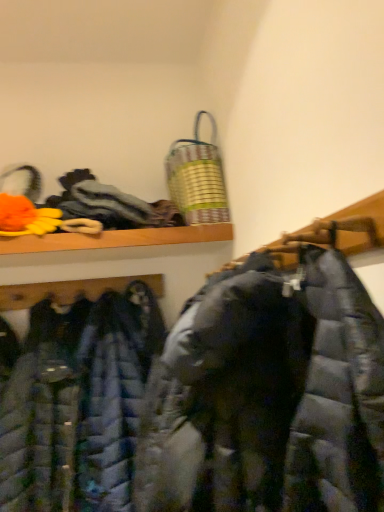
Question: Is textured gray cloth at upper left, arranged as the second cloak when ordered from the bottom, positioned far away from metallic striped laundry basket at upper center?

Choices:
 (A) yes
 (B) no

Answer: (B)

Question: Is textured gray cloth at upper left, which is the first cloak in top-to-bottom order, thinner than metallic striped laundry basket at upper center?

Choices:
 (A) yes
 (B) no

Answer: (B)

Question: From a real-world perspective, is textured gray cloth at upper left, arranged as the second cloak when ordered from the bottom, physically above metallic striped laundry basket at upper center?

Choices:
 (A) no
 (B) yes

Answer: (A)

Question: Does textured gray cloth at upper left, which is the first cloak in top-to-bottom order, lie behind metallic striped laundry basket at upper center?

Choices:
 (A) no
 (B) yes

Answer: (A)

Question: Can you see textured gray cloth at upper left, which is the first cloak in top-to-bottom order, touching metallic striped laundry basket at upper center?

Choices:
 (A) yes
 (B) no

Answer: (B)

Question: Is textured gray cloth at upper left, which is the first cloak in top-to-bottom order, bigger than metallic striped laundry basket at upper center?

Choices:
 (A) yes
 (B) no

Answer: (A)

Question: From the image's perspective, is textured gray cloth at upper left, which is the first cloak in top-to-bottom order, on top of matte black puffer coat at center, the 1th cloak ordered from the bottom?

Choices:
 (A) no
 (B) yes

Answer: (B)

Question: Can you confirm if textured gray cloth at upper left, which is the first cloak in top-to-bottom order, is thinner than matte black puffer coat at center, the 1th cloak ordered from the bottom?

Choices:
 (A) yes
 (B) no

Answer: (B)

Question: Is textured gray cloth at upper left, arranged as the second cloak when ordered from the bottom, at the right side of matte black puffer coat at center, which is the 2th cloak from top to bottom?

Choices:
 (A) yes
 (B) no

Answer: (B)

Question: Is textured gray cloth at upper left, which is the first cloak in top-to-bottom order, in front of matte black puffer coat at center, the 1th cloak ordered from the bottom?

Choices:
 (A) yes
 (B) no

Answer: (B)

Question: Can you confirm if textured gray cloth at upper left, which is the first cloak in top-to-bottom order, is shorter than matte black puffer coat at center, the 1th cloak ordered from the bottom?

Choices:
 (A) no
 (B) yes

Answer: (B)

Question: From the image's perspective, is textured gray cloth at upper left, arranged as the second cloak when ordered from the bottom, beneath matte black puffer coat at center, the 1th cloak ordered from the bottom?

Choices:
 (A) no
 (B) yes

Answer: (A)

Question: From a real-world perspective, is metallic striped laundry basket at upper center over matte black puffer coat at center, the 1th cloak ordered from the bottom?

Choices:
 (A) yes
 (B) no

Answer: (A)